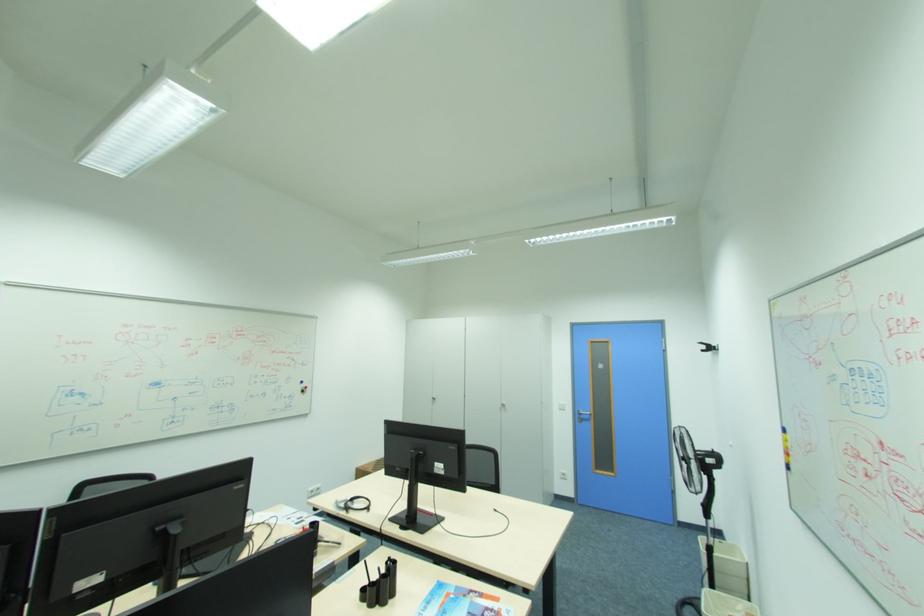
Find the location of `black headphones`. black headphones is located at coordinates (354, 504).